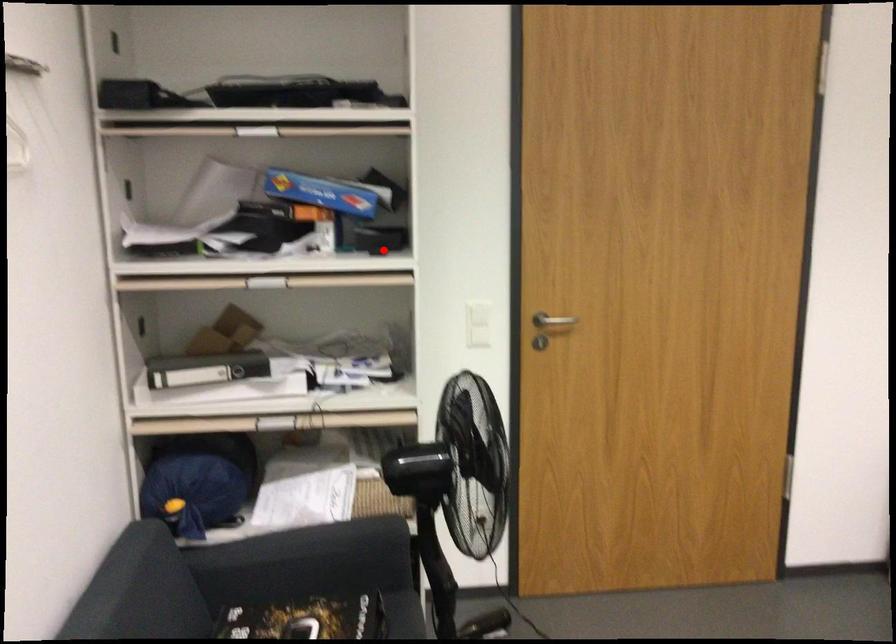
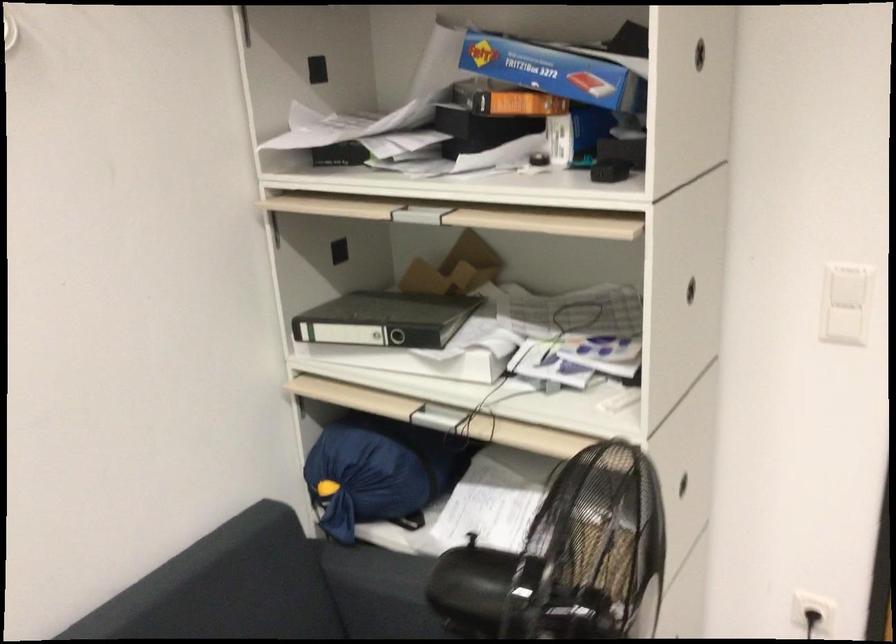
The point at the highlighted location is marked in the first image. Where is the corresponding point in the second image?

(608, 171)